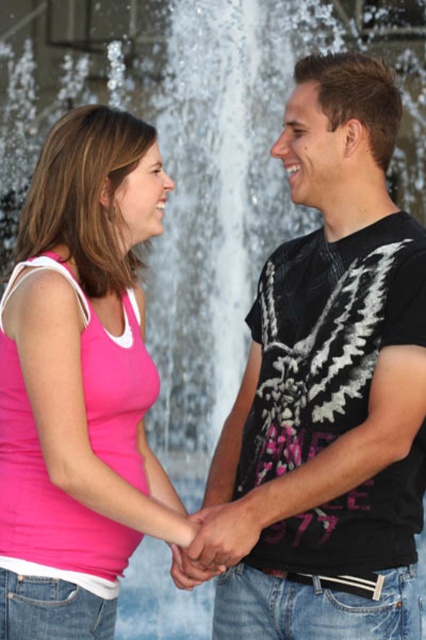
Question: Where is black printed t-shirt at center located in relation to pink matte tank top at center in the image?

Choices:
 (A) right
 (B) left

Answer: (A)

Question: Can you confirm if black printed t-shirt at center is thinner than pink matte tank top at center?

Choices:
 (A) no
 (B) yes

Answer: (A)

Question: Can you confirm if black printed t-shirt at center is thinner than pink matte tank top at center?

Choices:
 (A) no
 (B) yes

Answer: (A)

Question: Among these objects, which one is farthest from the camera?

Choices:
 (A) pink matte tank top at center
 (B) black printed t-shirt at center

Answer: (B)

Question: Which of the following is the farthest from the observer?

Choices:
 (A) pink matte tank top at center
 (B) black printed t-shirt at center

Answer: (B)